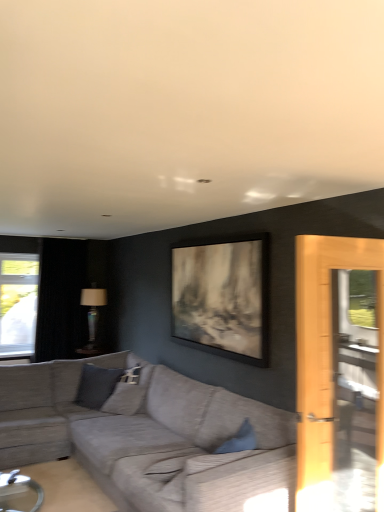
Question: Is matte glass lamp at center looking in the opposite direction of textured gray couch at center?

Choices:
 (A) no
 (B) yes

Answer: (A)

Question: Is matte glass lamp at center oriented towards textured gray couch at center?

Choices:
 (A) yes
 (B) no

Answer: (B)

Question: Is matte glass lamp at center smaller than textured gray couch at center?

Choices:
 (A) yes
 (B) no

Answer: (A)

Question: Is the surface of matte glass lamp at center in direct contact with textured gray couch at center?

Choices:
 (A) yes
 (B) no

Answer: (B)

Question: Is matte glass lamp at center not close to textured gray couch at center?

Choices:
 (A) yes
 (B) no

Answer: (A)

Question: From the image's perspective, does matte glass lamp at center appear higher than textured gray couch at center?

Choices:
 (A) yes
 (B) no

Answer: (A)

Question: Is gray fabric pillow at center completely or partially inside black velvet curtain at left?

Choices:
 (A) no
 (B) yes

Answer: (A)

Question: Are black velvet curtain at left and gray fabric pillow at center far apart?

Choices:
 (A) yes
 (B) no

Answer: (A)

Question: Does black velvet curtain at left have a lesser width compared to gray fabric pillow at center?

Choices:
 (A) no
 (B) yes

Answer: (A)

Question: From the image's perspective, is black velvet curtain at left on top of gray fabric pillow at center?

Choices:
 (A) yes
 (B) no

Answer: (A)

Question: Can you confirm if black velvet curtain at left is wider than gray fabric pillow at center?

Choices:
 (A) yes
 (B) no

Answer: (A)

Question: Considering the relative positions of black velvet curtain at left and gray fabric pillow at center in the image provided, is black velvet curtain at left to the left of gray fabric pillow at center from the viewer's perspective?

Choices:
 (A) no
 (B) yes

Answer: (B)

Question: From a real-world perspective, is matte glass lamp at center physically below gray fabric pillow at center?

Choices:
 (A) no
 (B) yes

Answer: (A)